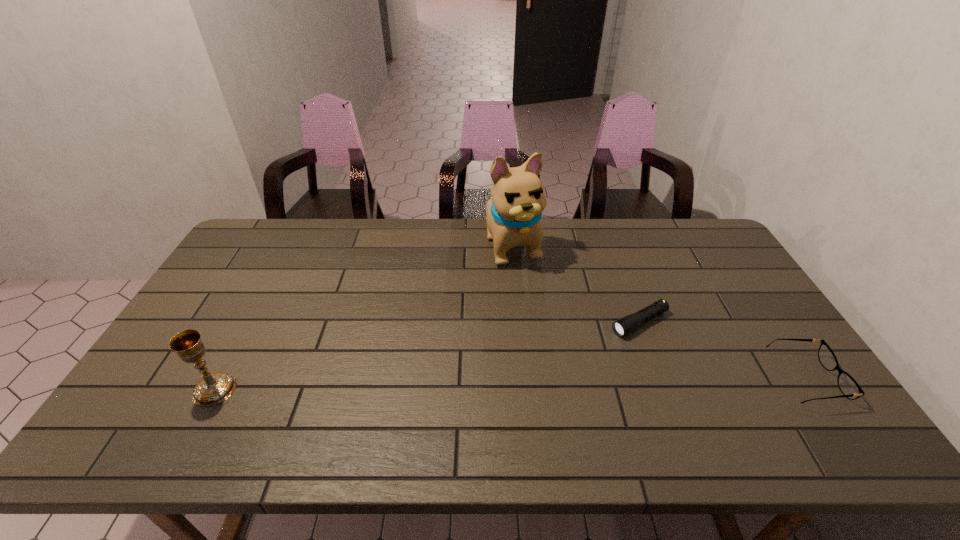
At what (x,y) coordinates should I click in order to perform the action: click on object located at the near left corner. Please return your answer as a coordinate pair (x, y). The width and height of the screenshot is (960, 540). Looking at the image, I should click on (213, 389).

Where is `object that is at the near right corner`? The height and width of the screenshot is (540, 960). object that is at the near right corner is located at coordinates (849, 387).

Where is `vacant area at the far edge of the desktop`? The height and width of the screenshot is (540, 960). vacant area at the far edge of the desktop is located at coordinates (615, 243).

Locate an element on the screen. The width and height of the screenshot is (960, 540). vacant region at the near edge is located at coordinates (388, 397).

Where is `vacant space at the left edge of the desktop`? The height and width of the screenshot is (540, 960). vacant space at the left edge of the desktop is located at coordinates (228, 327).

Locate an element on the screen. free space at the right edge of the desktop is located at coordinates (756, 296).

Identify the location of free space at the far left corner of the desktop. This screenshot has height=540, width=960. (250, 235).

At what (x,y) coordinates should I click in order to perform the action: click on vacant space in between the chalice and the shortest object. Please return your answer as a coordinate pair (x, y). The width and height of the screenshot is (960, 540). Looking at the image, I should click on (427, 356).

The width and height of the screenshot is (960, 540). I want to click on vacant space in between the second farthest object and the third shortest object, so click(x=427, y=356).

Image resolution: width=960 pixels, height=540 pixels. I want to click on vacant space that is in between the shortest object and the second tallest object, so click(x=427, y=356).